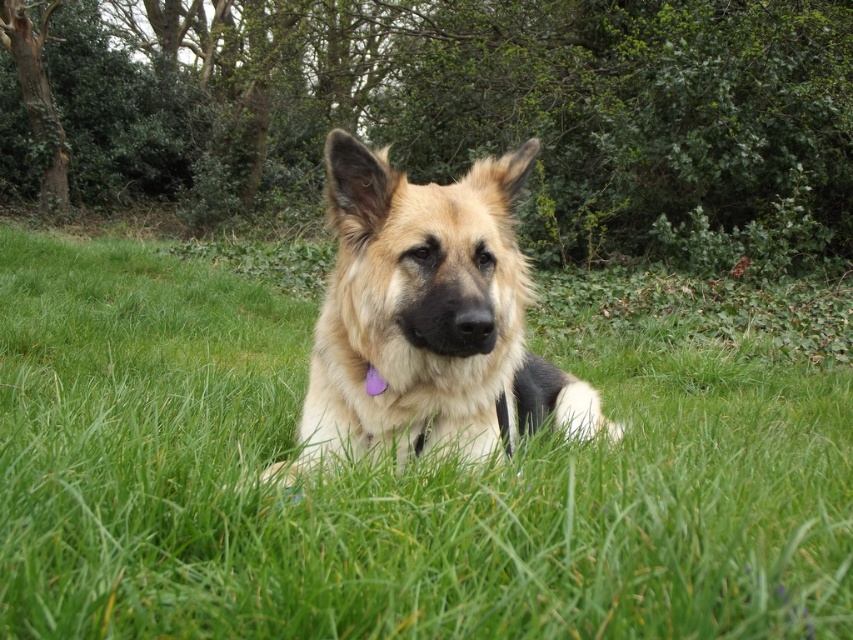
Does green grass at center have a larger size compared to golden fur dog at center?

Incorrect, green grass at center is not larger than golden fur dog at center.

Where is `green grass at center`? green grass at center is located at coordinates (386, 483).